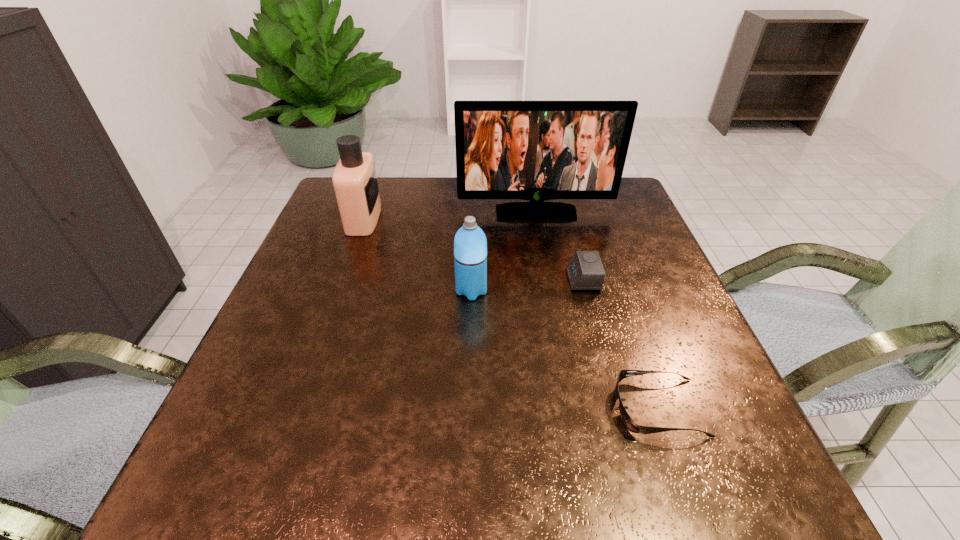
Find the location of a particular element. Image resolution: width=960 pixels, height=540 pixels. alarm clock situated at the right edge is located at coordinates (585, 271).

Find the location of `sunglasses that is at the right edge`. sunglasses that is at the right edge is located at coordinates (627, 420).

Locate an element on the screen. object that is at the far left corner is located at coordinates (355, 183).

Where is `object positioned at the far right corner`? The width and height of the screenshot is (960, 540). object positioned at the far right corner is located at coordinates (530, 150).

Locate an element on the screen. free space at the near edge is located at coordinates (462, 464).

Where is `vacant space at the left edge of the desktop`? This screenshot has height=540, width=960. vacant space at the left edge of the desktop is located at coordinates (322, 322).

The image size is (960, 540). Find the location of `free point at the right edge`. free point at the right edge is located at coordinates (634, 224).

What are the coordinates of `vacant region at the far left corner of the desktop` in the screenshot? It's located at (319, 217).

Where is `free space at the far right corner of the desktop`? The height and width of the screenshot is (540, 960). free space at the far right corner of the desktop is located at coordinates (606, 218).

This screenshot has width=960, height=540. Find the location of `vacant space at the near right corner of the desktop`. vacant space at the near right corner of the desktop is located at coordinates (752, 481).